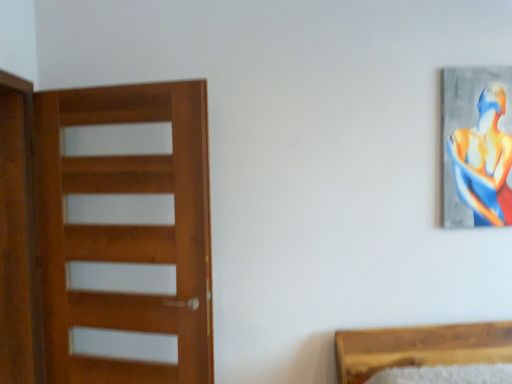
Question: From the image's perspective, is metallic silver painting at upper right located above or below wooden door at left?

Choices:
 (A) below
 (B) above

Answer: (B)

Question: Is metallic silver painting at upper right inside the boundaries of wooden door at left, or outside?

Choices:
 (A) outside
 (B) inside

Answer: (A)

Question: Estimate the real-world distances between objects in this image. Which object is closer to the brown wooden screen door at left?

Choices:
 (A) wooden door at left
 (B) metallic silver painting at upper right

Answer: (A)

Question: Which object is the farthest from the wooden door at left?

Choices:
 (A) brown wooden screen door at left
 (B) metallic silver painting at upper right

Answer: (B)